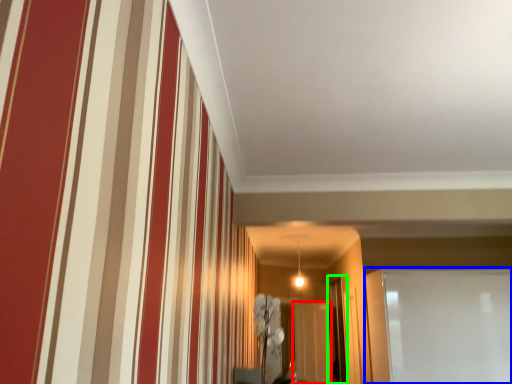
Question: Considering the real-world distances, which object is farthest from glass door (highlighted by a red box)? glass door (highlighted by a blue box) or glass door (highlighted by a green box)?

Choices:
 (A) glass door
 (B) glass door

Answer: (A)